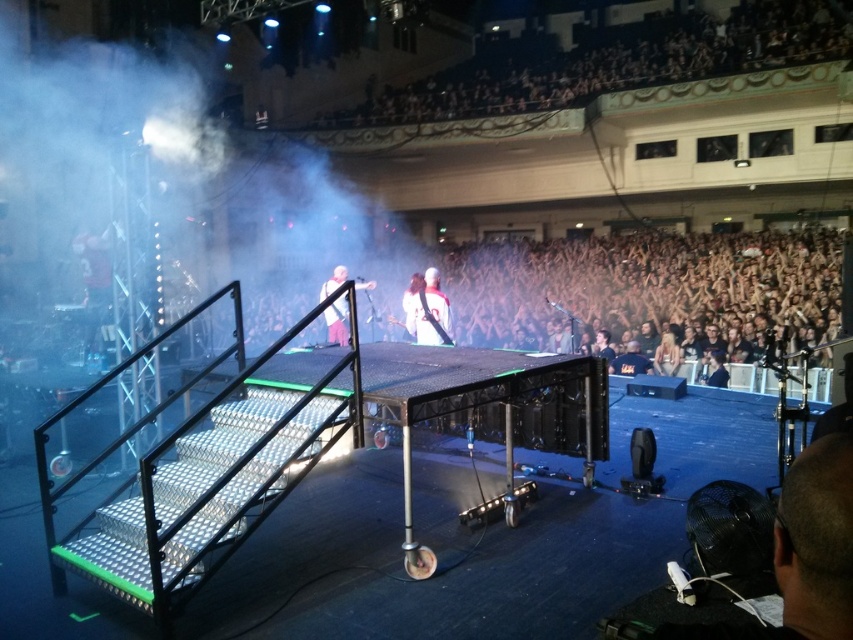
Question: Does white matte shirt at center lie behind white fabric guitar at center?

Choices:
 (A) yes
 (B) no

Answer: (A)

Question: Is white matte shirt at center wider than white fabric guitar at center?

Choices:
 (A) no
 (B) yes

Answer: (A)

Question: Which point appears farthest from the camera in this image?

Choices:
 (A) (331, 336)
 (B) (212, 140)
 (C) (427, 340)

Answer: (B)

Question: Is white fog at stage center further to camera compared to white fabric guitar at center?

Choices:
 (A) no
 (B) yes

Answer: (B)

Question: Which point is closer to the camera taking this photo?

Choices:
 (A) (374, 284)
 (B) (444, 330)
 (C) (167, 138)

Answer: (B)

Question: Which of the following is the closest to the observer?

Choices:
 (A) (450, 310)
 (B) (126, 250)

Answer: (B)